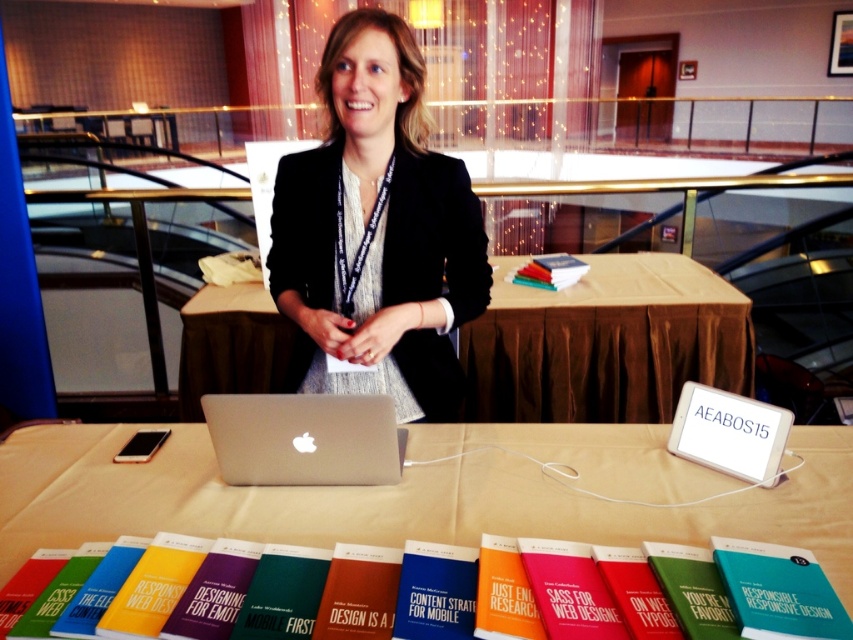
Is silver metallic laptop at center positioned at the back of hardcover books at center?

No, it is in front of hardcover books at center.

Between silver metallic laptop at center and hardcover books at center, which one has more height?

silver metallic laptop at center

Image resolution: width=853 pixels, height=640 pixels. Find the location of `silver metallic laptop at center`. silver metallic laptop at center is located at coordinates (305, 438).

Is point (361, 248) more distant than point (416, 556)?

Yes, it is.

Which is behind, point (339, 310) or point (450, 548)?

Positioned behind is point (339, 310).

At what (x,y) coordinates should I click in order to perform the action: click on black textured blazer at center. Please return your answer as a coordinate pair (x, y). Looking at the image, I should click on (376, 230).

Does blue hardcover book at center appear under hardcover books at center?

Indeed, blue hardcover book at center is positioned under hardcover books at center.

Who is more distant from viewer, (152, 538) or (556, 285)?

The point (556, 285) is more distant.

This screenshot has width=853, height=640. In order to click on blue hardcover book at center in this screenshot , I will do `click(154, 586)`.